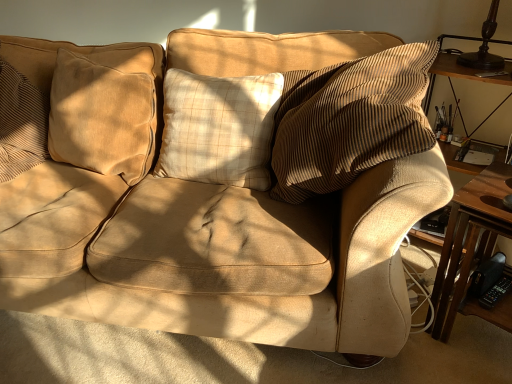
Where is `suede-like beige pillow at left, placed as the 2th pillow when sorted from right to left`? The width and height of the screenshot is (512, 384). suede-like beige pillow at left, placed as the 2th pillow when sorted from right to left is located at coordinates (106, 111).

You are a GUI agent. You are given a task and a screenshot of the screen. Output one action in this format:
    pyautogui.click(x=<x>, y=<y>)
    Task: Click on the beige plaid pillow at center, positioned as the 1th pillow in right-to-left order
    Image resolution: width=512 pixels, height=384 pixels.
    Given the screenshot: What is the action you would take?
    pyautogui.click(x=219, y=128)

Considering the positions of objects beige plaid pillow at center, positioned as the 1th pillow in right-to-left order, and wooden table at right in the image provided, who is more to the right, beige plaid pillow at center, positioned as the 1th pillow in right-to-left order, or wooden table at right?

Positioned to the right is wooden table at right.

Locate an element on the screen. This screenshot has height=384, width=512. table that appears below the beige plaid pillow at center, positioned as the 1th pillow in right-to-left order (from a real-world perspective) is located at coordinates (473, 235).

Can you confirm if beige plaid pillow at center, positioned as the 1th pillow in right-to-left order, is shorter than wooden table at right?

Yes, beige plaid pillow at center, positioned as the 1th pillow in right-to-left order, is shorter than wooden table at right.

Does beige plaid pillow at center, positioned as the 1th pillow in right-to-left order, touch wooden table at right?

No, beige plaid pillow at center, positioned as the 1th pillow in right-to-left order, is not touching wooden table at right.

Consider the image. Is wooden table at right facing away from beige plaid pillow at center, positioned as the 1th pillow in right-to-left order?

No, wooden table at right is not facing the opposite direction of beige plaid pillow at center, positioned as the 1th pillow in right-to-left order.

Which of these two, wooden table at right or beige plaid pillow at center, positioned as the 1th pillow in right-to-left order, is bigger?

With larger size is wooden table at right.

From their relative heights in the image, would you say wooden table at right is taller or shorter than beige plaid pillow at center, which ranks as the second pillow in left-to-right order?

Clearly, wooden table at right is taller compared to beige plaid pillow at center, which ranks as the second pillow in left-to-right order.

How much distance is there between wooden table at right and beige plaid pillow at center, positioned as the 1th pillow in right-to-left order?

wooden table at right is 29.93 inches from beige plaid pillow at center, positioned as the 1th pillow in right-to-left order.

Is wooden table at right to the right of suede-like beige pillow at left, placed as the 2th pillow when sorted from right to left, from the viewer's perspective?

Yes.

From a real-world perspective, is wooden table at right beneath suede-like beige pillow at left, marked as the 1th pillow in a left-to-right arrangement?

Yes.

From the image's perspective, is wooden table at right on suede-like beige pillow at left, placed as the 2th pillow when sorted from right to left?

No.

Between wooden table at right and suede-like beige pillow at left, marked as the 1th pillow in a left-to-right arrangement, which one has more height?

With more height is wooden table at right.

Is suede-like beige pillow at left, marked as the 1th pillow in a left-to-right arrangement, at the left side of wooden table at right?

Correct, you'll find suede-like beige pillow at left, marked as the 1th pillow in a left-to-right arrangement, to the left of wooden table at right.

How many degrees apart are the facing directions of suede-like beige pillow at left, marked as the 1th pillow in a left-to-right arrangement, and wooden table at right?

13.4 degrees separate the facing orientations of suede-like beige pillow at left, marked as the 1th pillow in a left-to-right arrangement, and wooden table at right.

Looking at this image, how much distance is there between suede-like beige pillow at left, placed as the 2th pillow when sorted from right to left, and wooden table at right?

suede-like beige pillow at left, placed as the 2th pillow when sorted from right to left, is 1.19 meters from wooden table at right.

From the image's perspective, is suede-like beige pillow at left, marked as the 1th pillow in a left-to-right arrangement, below wooden table at right?

No, from the image's perspective, suede-like beige pillow at left, marked as the 1th pillow in a left-to-right arrangement, is not below wooden table at right.

Is suede-like beige pillow at left, placed as the 2th pillow when sorted from right to left, not near beige plaid pillow at center, which ranks as the second pillow in left-to-right order?

No, suede-like beige pillow at left, placed as the 2th pillow when sorted from right to left, is in close proximity to beige plaid pillow at center, which ranks as the second pillow in left-to-right order.

Would you say beige plaid pillow at center, which ranks as the second pillow in left-to-right order, is part of suede-like beige pillow at left, placed as the 2th pillow when sorted from right to left,'s contents?

That's incorrect, beige plaid pillow at center, which ranks as the second pillow in left-to-right order, is not inside suede-like beige pillow at left, placed as the 2th pillow when sorted from right to left.

Can you confirm if suede-like beige pillow at left, marked as the 1th pillow in a left-to-right arrangement, is wider than beige plaid pillow at center, positioned as the 1th pillow in right-to-left order?

In fact, suede-like beige pillow at left, marked as the 1th pillow in a left-to-right arrangement, might be narrower than beige plaid pillow at center, positioned as the 1th pillow in right-to-left order.

Considering the points (57, 87) and (262, 152), which point is in front, point (57, 87) or point (262, 152)?

The point (262, 152) is more forward.

From a real-world perspective, does beige plaid pillow at center, positioned as the 1th pillow in right-to-left order, sit lower than suede-like beige pillow at left, placed as the 2th pillow when sorted from right to left?

Indeed, from a real-world perspective, beige plaid pillow at center, positioned as the 1th pillow in right-to-left order, is positioned beneath suede-like beige pillow at left, placed as the 2th pillow when sorted from right to left.

Looking at this image, which is less distant, (190, 167) or (138, 160)?

Point (190, 167) is closer to the camera than point (138, 160).

In the scene shown: Is beige plaid pillow at center, which ranks as the second pillow in left-to-right order, positioned far away from suede-like beige pillow at left, placed as the 2th pillow when sorted from right to left?

beige plaid pillow at center, which ranks as the second pillow in left-to-right order, is near suede-like beige pillow at left, placed as the 2th pillow when sorted from right to left, not far away.

Which object is wider, beige plaid pillow at center, which ranks as the second pillow in left-to-right order, or suede-like beige pillow at left, placed as the 2th pillow when sorted from right to left?

With larger width is beige plaid pillow at center, which ranks as the second pillow in left-to-right order.

From a real-world perspective, which pillow is the 1st one above the wooden table at right? Please provide its 2D coordinates.

[(219, 128)]

You are a GUI agent. You are given a task and a screenshot of the screen. Output one action in this format:
    pyautogui.click(x=<x>, y=<y>)
    Task: Click on the table below the beige plaid pillow at center, which ranks as the second pillow in left-to-right order (from the image's perspective)
    The width and height of the screenshot is (512, 384).
    Given the screenshot: What is the action you would take?
    [x=473, y=235]

Estimate the real-world distances between objects in this image. Which object is further from suede-like beige pillow at left, placed as the 2th pillow when sorted from right to left, wooden table at right or beige plaid pillow at center, which ranks as the second pillow in left-to-right order?

Among the two, wooden table at right is located further to suede-like beige pillow at left, placed as the 2th pillow when sorted from right to left.

Based on their spatial positions, is suede-like beige pillow at left, placed as the 2th pillow when sorted from right to left, or beige plaid pillow at center, positioned as the 1th pillow in right-to-left order, closer to wooden table at right?

beige plaid pillow at center, positioned as the 1th pillow in right-to-left order, is closer to wooden table at right.

Which object lies further to the anchor point beige plaid pillow at center, positioned as the 1th pillow in right-to-left order, wooden table at right or suede-like beige pillow at left, marked as the 1th pillow in a left-to-right arrangement?

wooden table at right lies further to beige plaid pillow at center, positioned as the 1th pillow in right-to-left order, than the other object.

When comparing their distances from wooden table at right, does beige plaid pillow at center, which ranks as the second pillow in left-to-right order, or suede-like beige pillow at left, placed as the 2th pillow when sorted from right to left, seem closer?

beige plaid pillow at center, which ranks as the second pillow in left-to-right order, is positioned closer to the anchor wooden table at right.

Which object lies nearer to the anchor point beige plaid pillow at center, which ranks as the second pillow in left-to-right order, suede-like beige pillow at left, placed as the 2th pillow when sorted from right to left, or wooden table at right?

suede-like beige pillow at left, placed as the 2th pillow when sorted from right to left.

When comparing their distances from suede-like beige pillow at left, placed as the 2th pillow when sorted from right to left, does beige plaid pillow at center, positioned as the 1th pillow in right-to-left order, or wooden table at right seem further?

wooden table at right.

Find the location of a particular element. The width and height of the screenshot is (512, 384). pillow situated between suede-like beige pillow at left, placed as the 2th pillow when sorted from right to left, and wooden table at right from left to right is located at coordinates (219, 128).